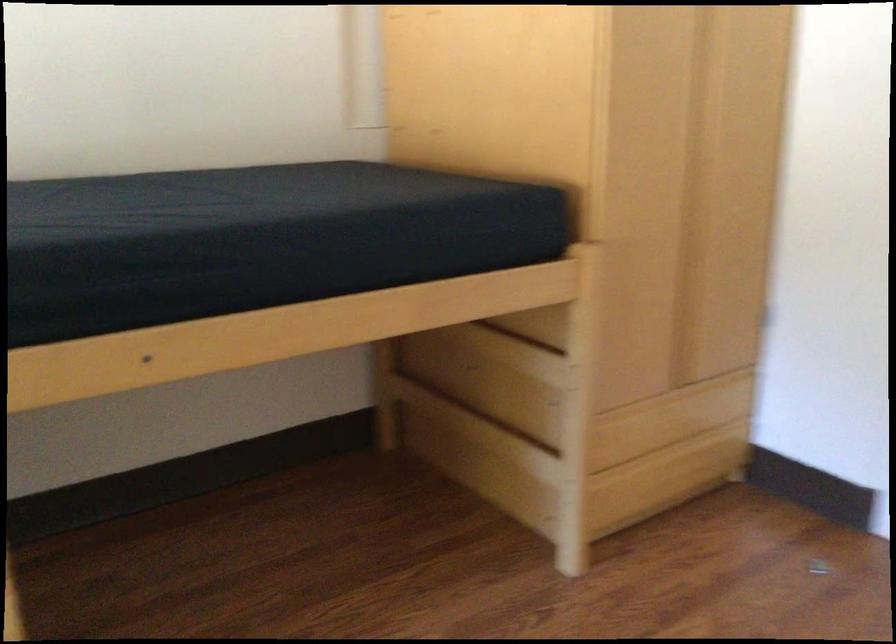
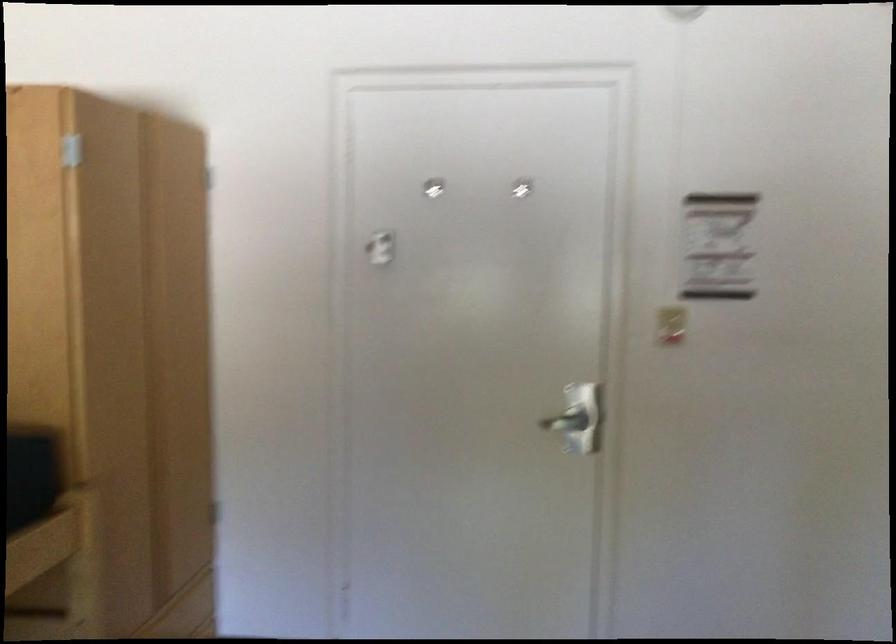
Question: The camera is either moving clockwise (left) or counter-clockwise (right) around the object. The first image is from the beginning of the video and the second image is from the end. Is the camera moving left or right when shooting the video?

Choices:
 (A) Left
 (B) Right

Answer: (A)